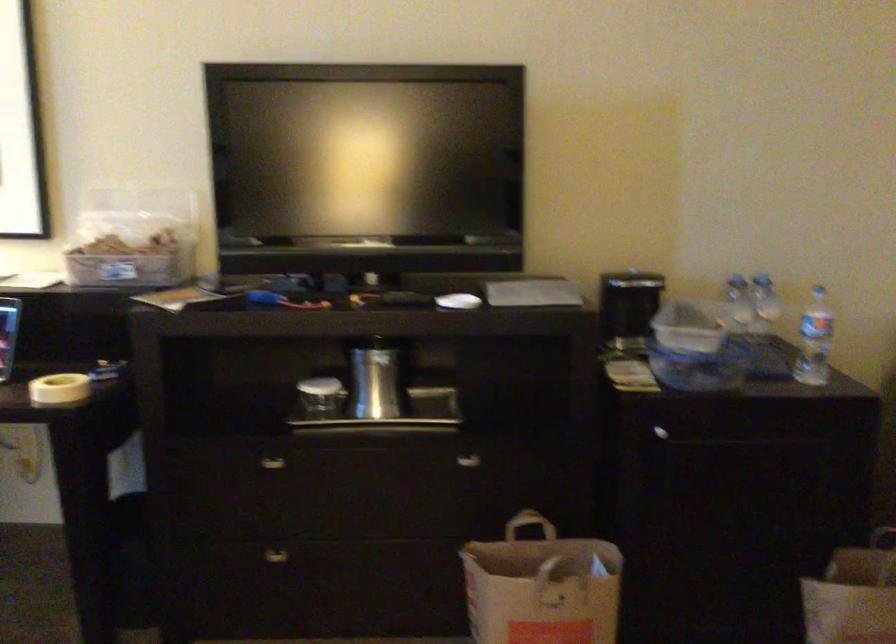
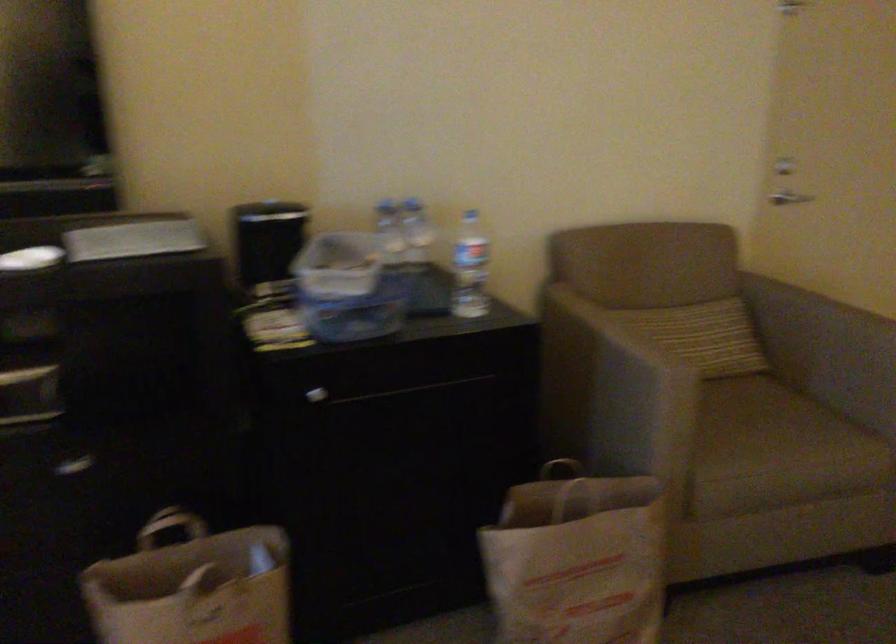
Find the pixel in the second image that matches [812,334] in the first image.

(470, 268)